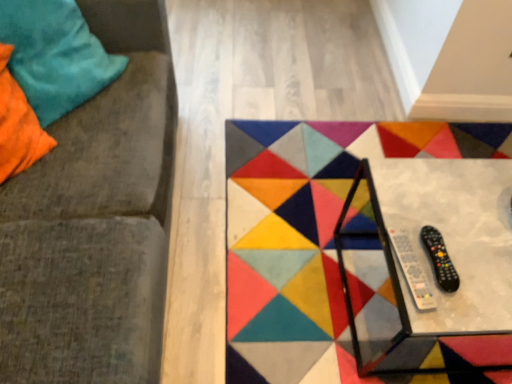
Where is `free space on the front side of black plastic remote control at lower right`? Image resolution: width=512 pixels, height=384 pixels. free space on the front side of black plastic remote control at lower right is located at coordinates (452, 309).